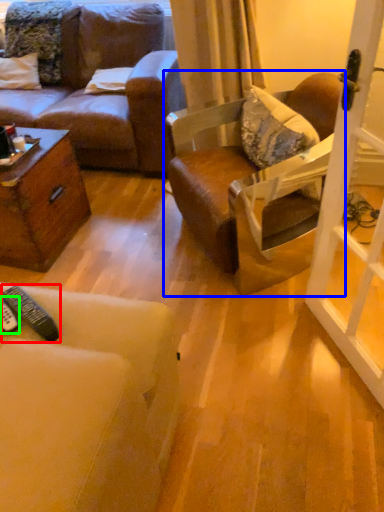
Question: Which object is the farthest from remote control (highlighted by a red box)? Choose among these: chair (highlighted by a blue box) or remote control (highlighted by a green box).

Choices:
 (A) chair
 (B) remote control

Answer: (A)